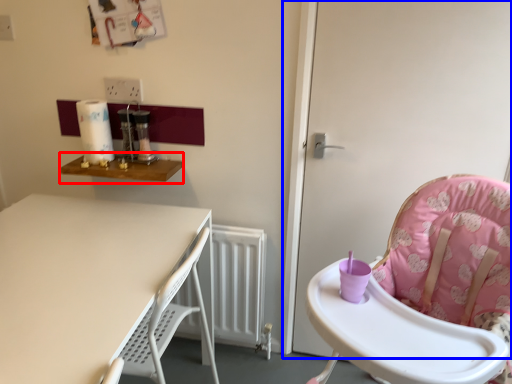
Question: Which of the following is the farthest to the observer, table (highlighted by a red box) or screen door (highlighted by a blue box)?

Choices:
 (A) table
 (B) screen door

Answer: (A)